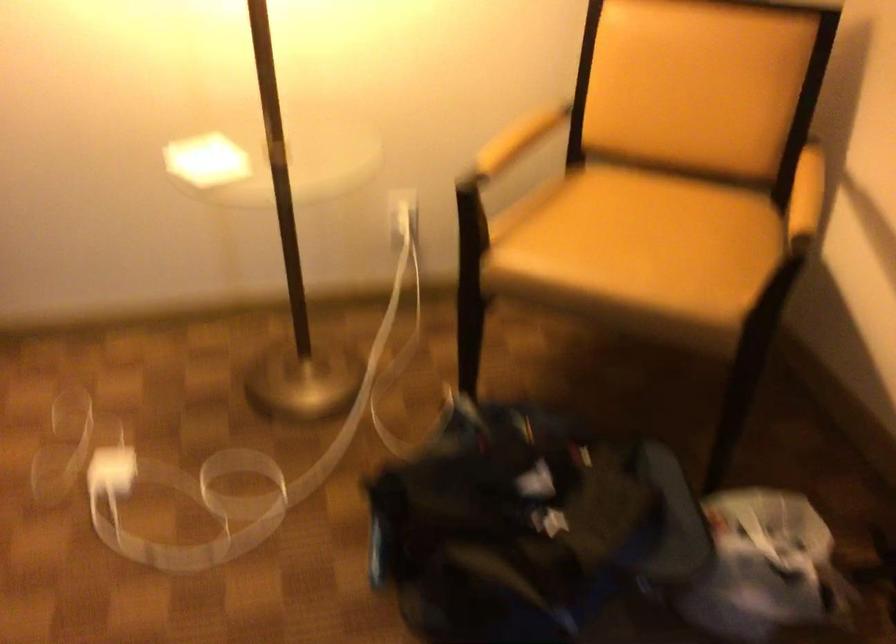
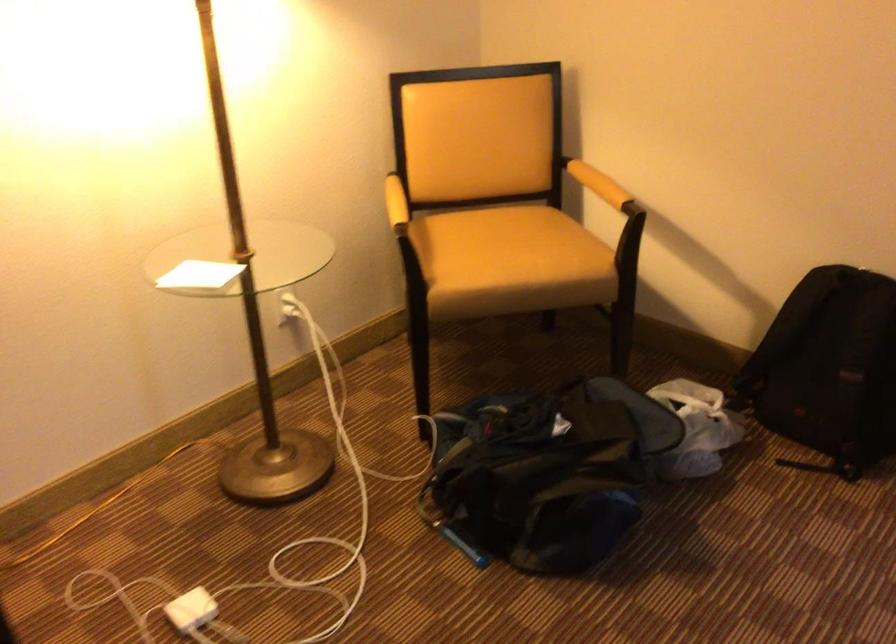
The point at [459,533] is marked in the first image. Where is the corresponding point in the second image?

(537, 480)